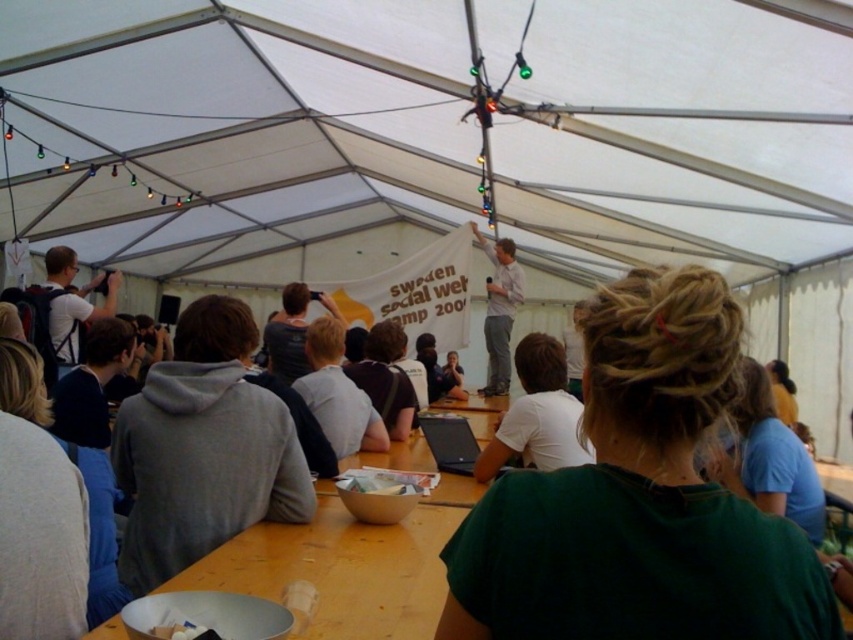
You are organizing a photo shoot for a clothing brand and need to ensure that the matte white shirt at left and the light gray shirt at upper center are visible in the frame. Based on their positions, which shirt should you focus on first to capture both in the shot?

The matte white shirt at left is positioned over the light gray shirt at upper center, so focusing on the matte white shirt at left first will ensure both shirts are visible in the frame.

You are standing at the entrance of the tent and want to check if you can reach the white matte laptop at center without moving any objects. The distance you can stretch is 8 feet. Can you reach it?

The white matte laptop at center and viewer are 8.11 feet apart from each other. Since your stretching distance is 8 feet, you cannot reach it as the distance is slightly longer than your reach.

You are organizing a presentation and need to place a name tag on the table. The name tag is the same size as the light gray shirt at upper center. Will the white matte laptop at center fit on the table after placing the name tag?

The white matte laptop at center has a smaller size compared to the light gray shirt at upper center. Since the name tag is the same size as the light gray shirt at upper center, the laptop will fit on the table as it is smaller than the name tag, implying there is enough space.